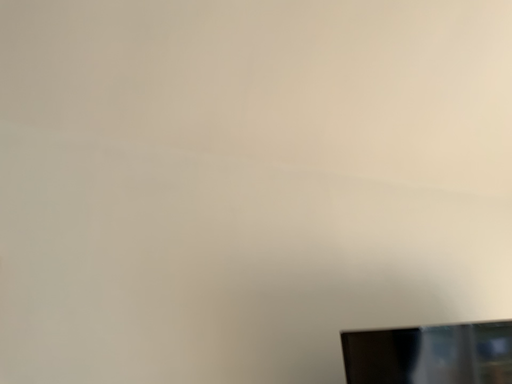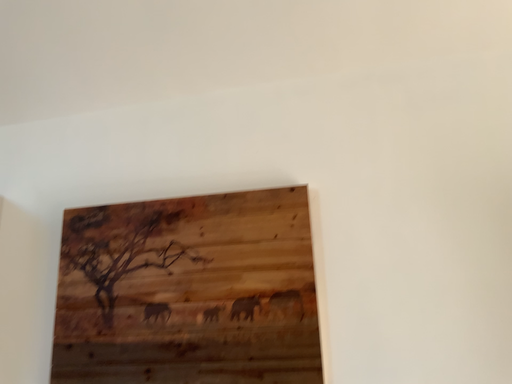
Question: How did the camera likely rotate when shooting the video?

Choices:
 (A) rotated right
 (B) rotated left

Answer: (B)